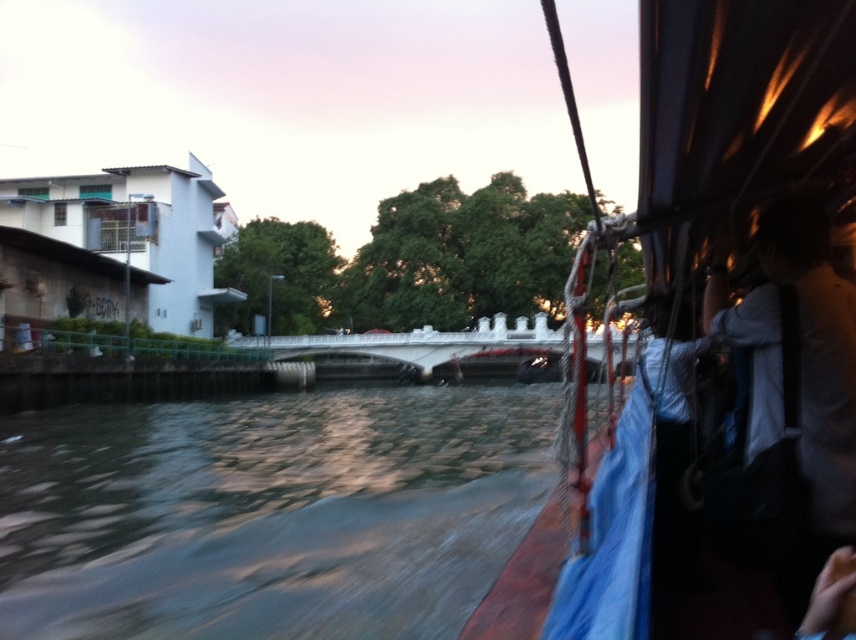
Does green stone river at center lie in front of white fabric bag at right?

No, it is not.

Which is in front, point (272, 492) or point (813, 445)?

Point (813, 445)

Which is in front, point (108, 604) or point (825, 449)?

Point (825, 449) is in front.

What are the coordinates of `green stone river at center` in the screenshot? It's located at (268, 513).

Is blue tarpaulin boat at right below white fabric bag at right?

No.

Which of these two, blue tarpaulin boat at right or white fabric bag at right, stands taller?

Standing taller between the two is blue tarpaulin boat at right.

Identify the location of blue tarpaulin boat at right. This screenshot has height=640, width=856. (736, 116).

Who is positioned more to the right, green stone river at center or blue tarpaulin boat at right?

blue tarpaulin boat at right

Does green stone river at center appear on the left side of blue tarpaulin boat at right?

Indeed, green stone river at center is positioned on the left side of blue tarpaulin boat at right.

Based on the photo, measure the distance between green stone river at center and camera.

3.22 meters

At what (x,y) coordinates should I click in order to perform the action: click on green stone river at center. Please return your answer as a coordinate pair (x, y). Looking at the image, I should click on (268, 513).